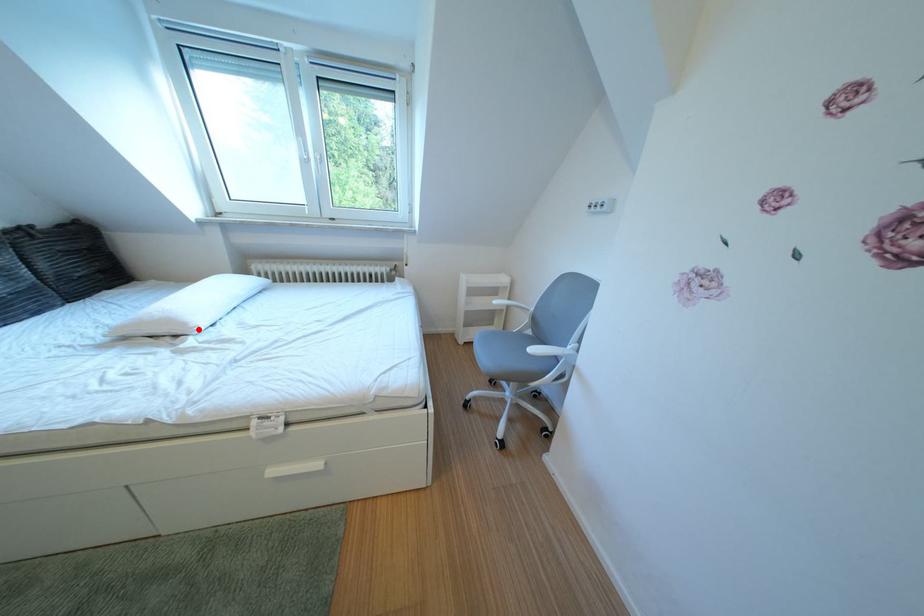
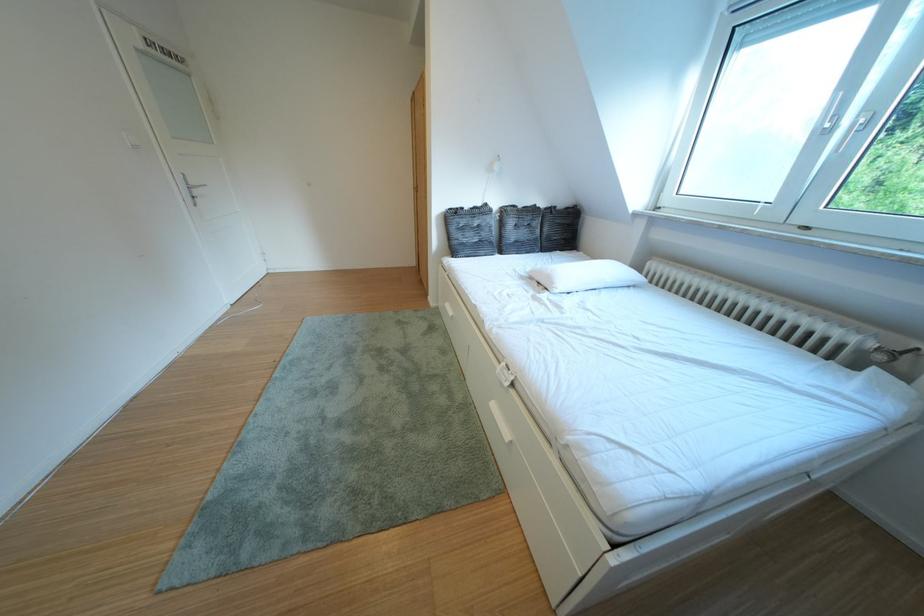
Locate, in the second image, the point that corresponds to the highlighted location in the first image.

(565, 288)